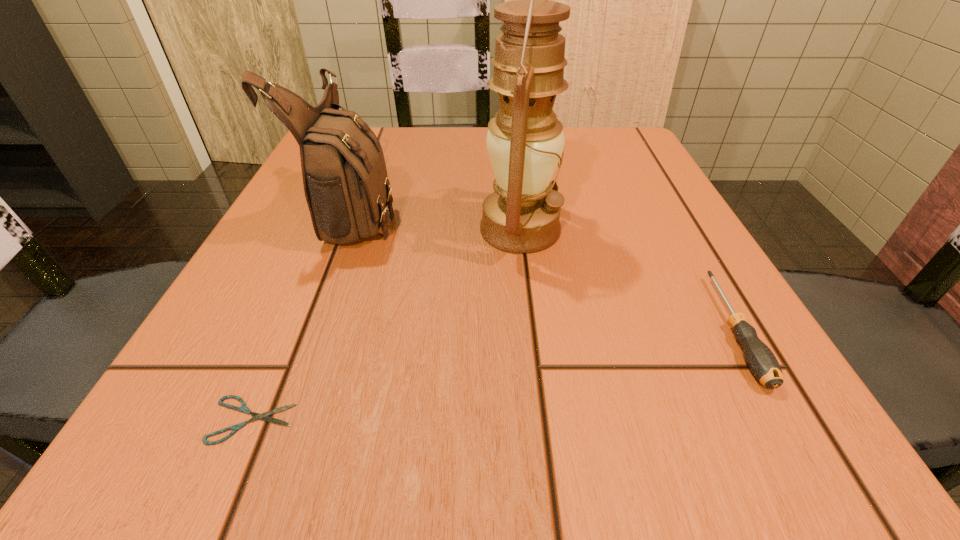
Locate an element on the screen. The height and width of the screenshot is (540, 960). the tallest object is located at coordinates (525, 141).

The width and height of the screenshot is (960, 540). Find the location of `the second object from right to left`. the second object from right to left is located at coordinates (525, 141).

The width and height of the screenshot is (960, 540). Identify the location of shoulder bag. (346, 186).

The height and width of the screenshot is (540, 960). What are the coordinates of `the rightmost object` in the screenshot? It's located at (761, 361).

Where is `the second nearest object`? The height and width of the screenshot is (540, 960). the second nearest object is located at coordinates (761, 361).

Locate an element on the screen. This screenshot has height=540, width=960. the shortest object is located at coordinates (243, 408).

I want to click on shears, so (243, 408).

The image size is (960, 540). I want to click on blank area located on the left of the oil lamp, so click(388, 230).

This screenshot has height=540, width=960. Identify the location of vacant space located on the front-facing side of the second tallest object. (517, 212).

Image resolution: width=960 pixels, height=540 pixels. In order to click on free space located on the left of the rightmost object in this screenshot , I will do `click(669, 329)`.